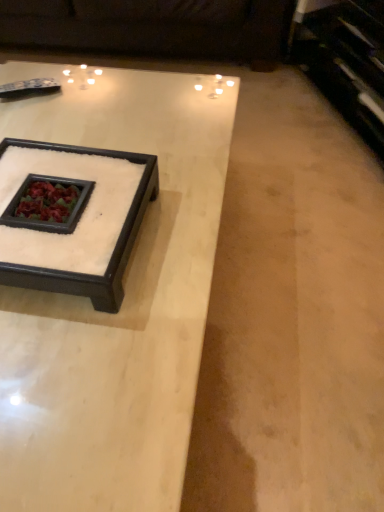
The height and width of the screenshot is (512, 384). Identify the location of free location above white marble coffee table at center, which ranks as the first coffee table in front-to-back order (from a real-world perspective). (107, 140).